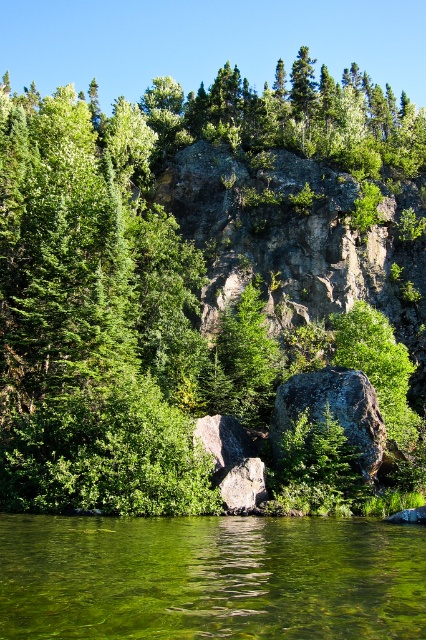
Looking at this image, you are a hiker who wants to cross the green translucent water at lower center to reach the green leafy tree at center. Given that your hiking boots can handle up to 150 feet of distance, will you be able to make the crossing safely?

The distance between the green leafy tree at center and the green translucent water at lower center is 145.31 feet, which is within the 150 feet limit your hiking boots can handle. Therefore, you can safely make the crossing.

You are standing at the edge of the green translucent water at lower center and want to reach the green leafy tree at center. Which direction should you move to get there?

The green leafy tree at center is to the left of green translucent water at lower center, so you should move to your left to reach it.